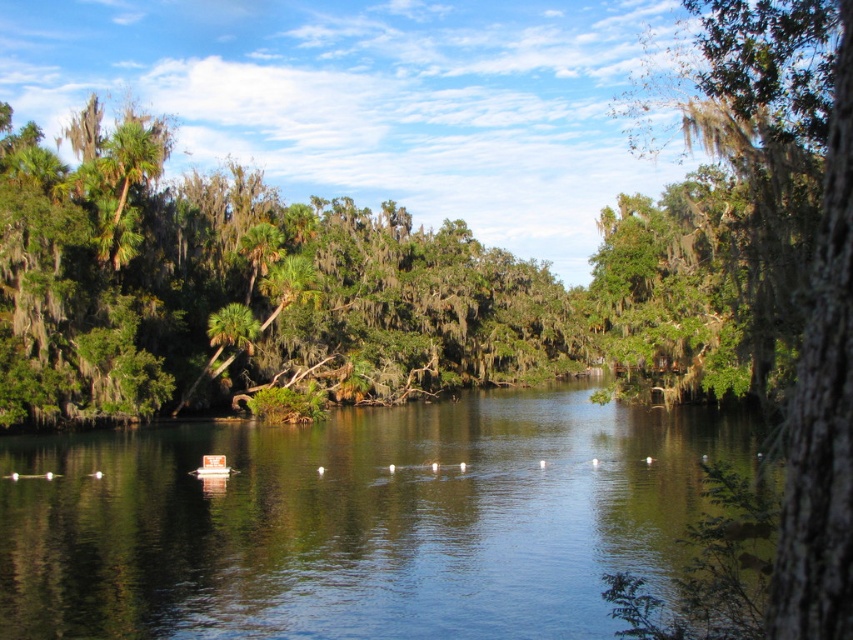
Does green reflective water at center appear over green mossy bark tree at right?

Actually, green reflective water at center is below green mossy bark tree at right.

Which of these two, green reflective water at center or green mossy bark tree at right, stands shorter?

Standing shorter between the two is green reflective water at center.

Between point (547, 552) and point (851, 602), which one is positioned behind?

Point (547, 552)

Find the location of a particular element. The height and width of the screenshot is (640, 853). green reflective water at center is located at coordinates (358, 520).